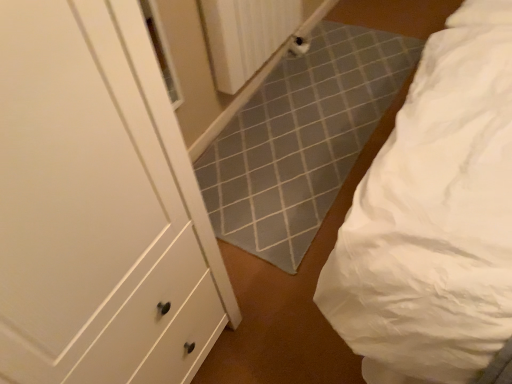
Question: Should I look upward or downward to see white plastic radiator at upper center?

Choices:
 (A) down
 (B) up

Answer: (B)